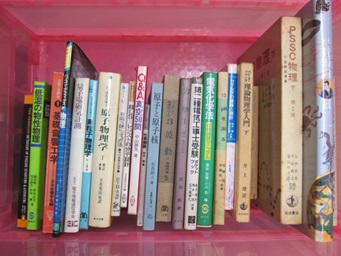
At what (x,y) coordinates should I click in order to perform the action: click on black book cover. Please return your answer as a coordinate pair (x, y). Looking at the image, I should click on (25, 156).